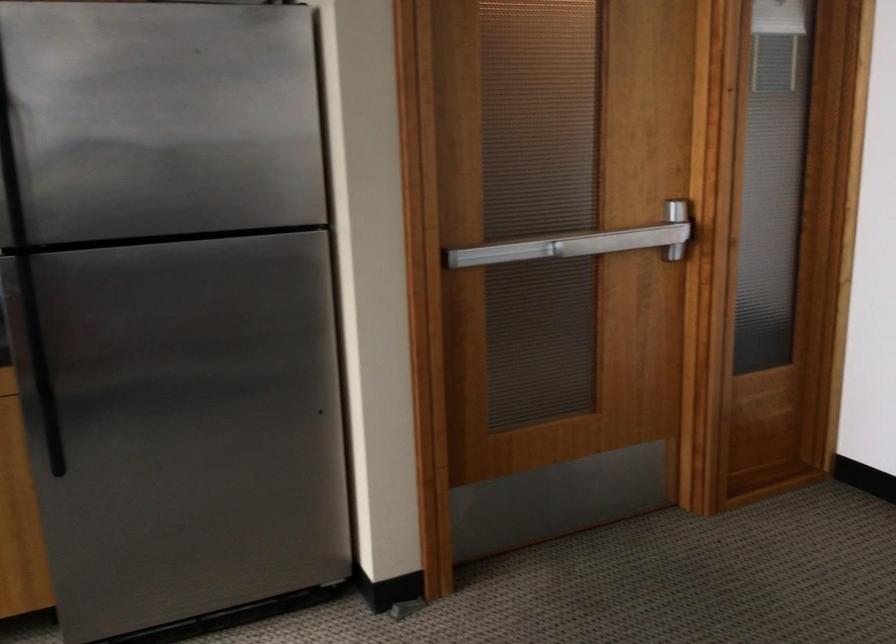
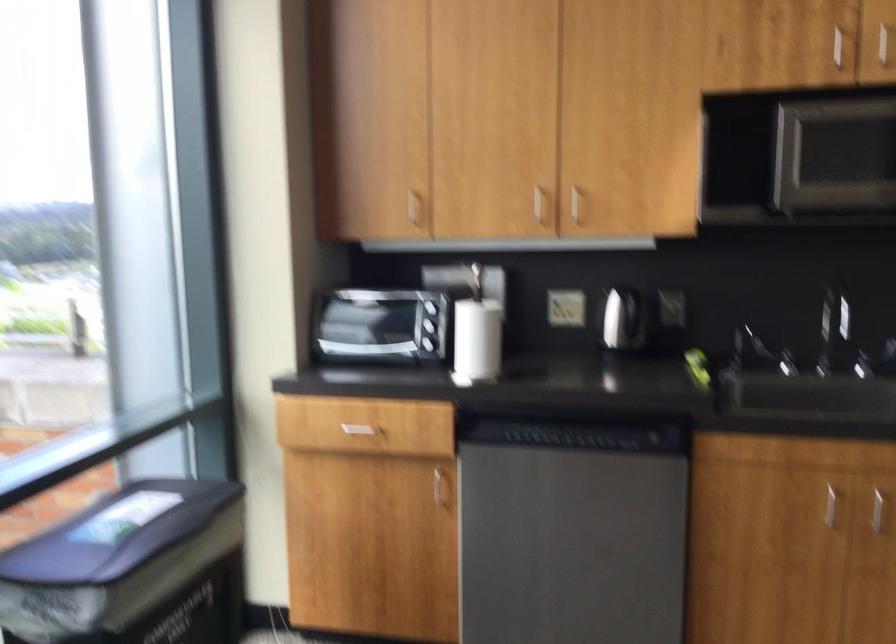
Question: The camera is either moving clockwise (left) or counter-clockwise (right) around the object. The first image is from the beginning of the video and the second image is from the end. Is the camera moving left or right when shooting the video?

Choices:
 (A) Left
 (B) Right

Answer: (B)